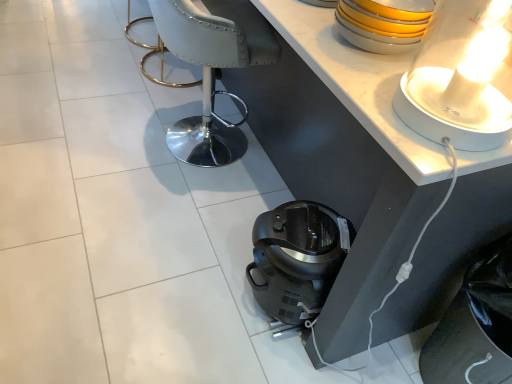
Where is `vacant space that is to the left of satin black coffee maker at lower center`? The width and height of the screenshot is (512, 384). vacant space that is to the left of satin black coffee maker at lower center is located at coordinates (216, 285).